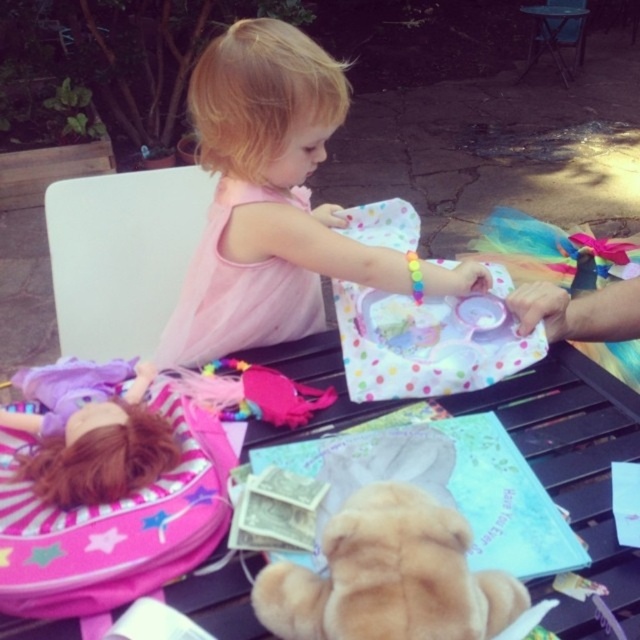
Question: Among these points, which one is nearest to the camera?

Choices:
 (A) (310, 573)
 (B) (540, 397)

Answer: (A)

Question: Which of the following is the closest to the observer?

Choices:
 (A) (246, 51)
 (B) (429, 561)

Answer: (B)

Question: Can you confirm if pink fabric dress at center is positioned to the right of fuzzy beige teddy bear at lower center?

Choices:
 (A) yes
 (B) no

Answer: (B)

Question: Is black plastic table at center smaller than fuzzy beige teddy bear at lower center?

Choices:
 (A) no
 (B) yes

Answer: (A)

Question: Among these objects, which one is nearest to the camera?

Choices:
 (A) pink fabric dress at center
 (B) black plastic table at center
 (C) fuzzy beige teddy bear at lower center

Answer: (C)

Question: Can you confirm if pink fabric dress at center is positioned below black plastic table at center?

Choices:
 (A) yes
 (B) no

Answer: (B)